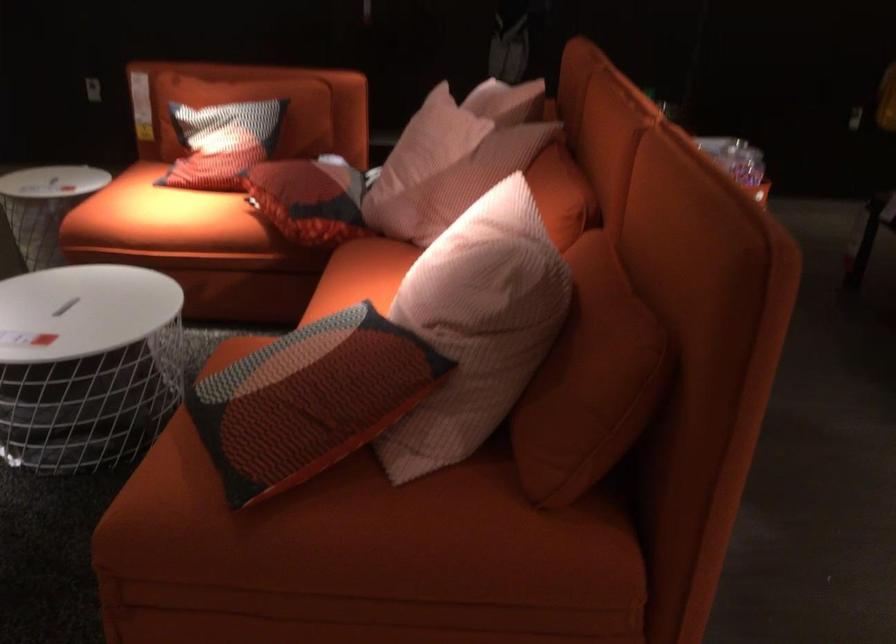
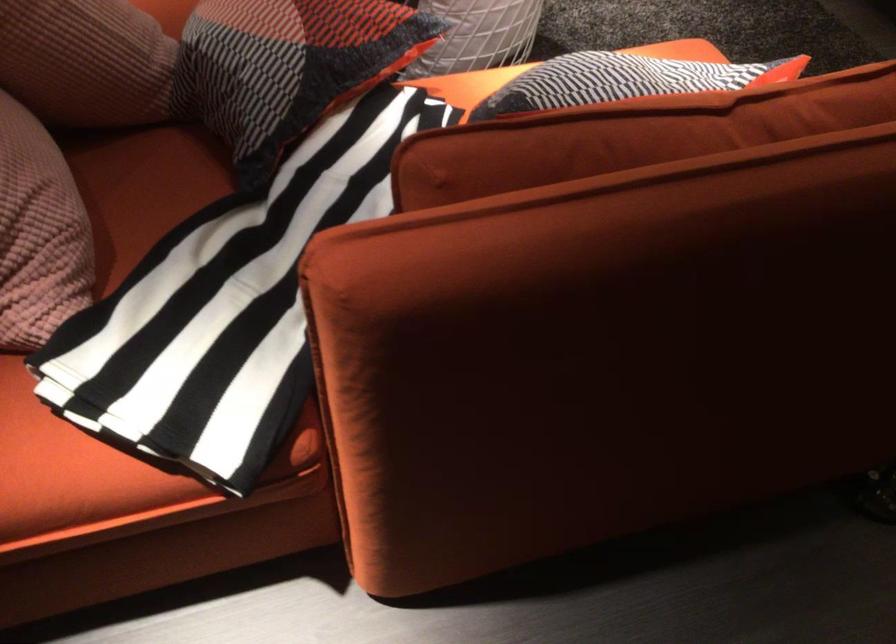
Find the pixel in the second image that matches pixel 240 105 in the first image.

(623, 80)